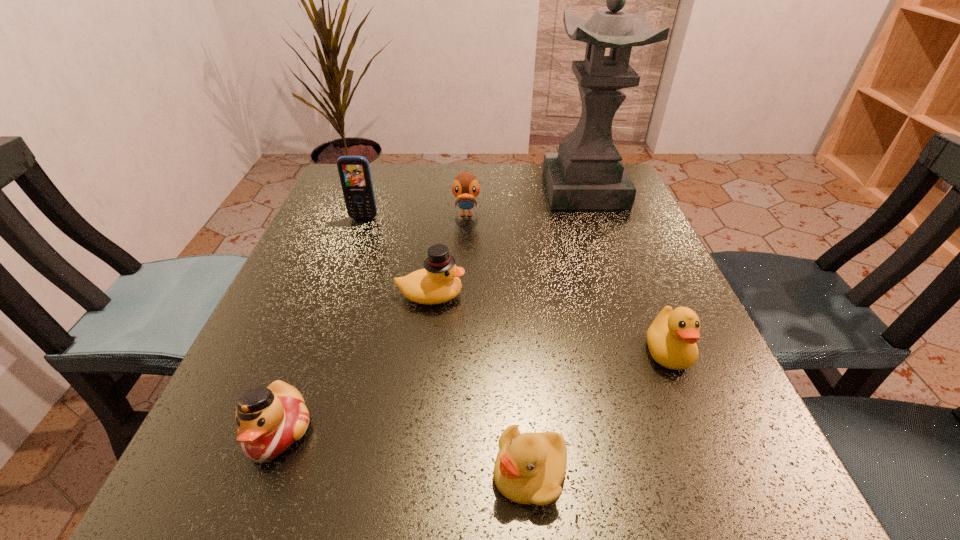
I want to click on free point that satisfies the following two spatial constraints: 1. on the front-facing side of the farthest duck; 2. on the front-facing side of the second farthest duck, so (463, 295).